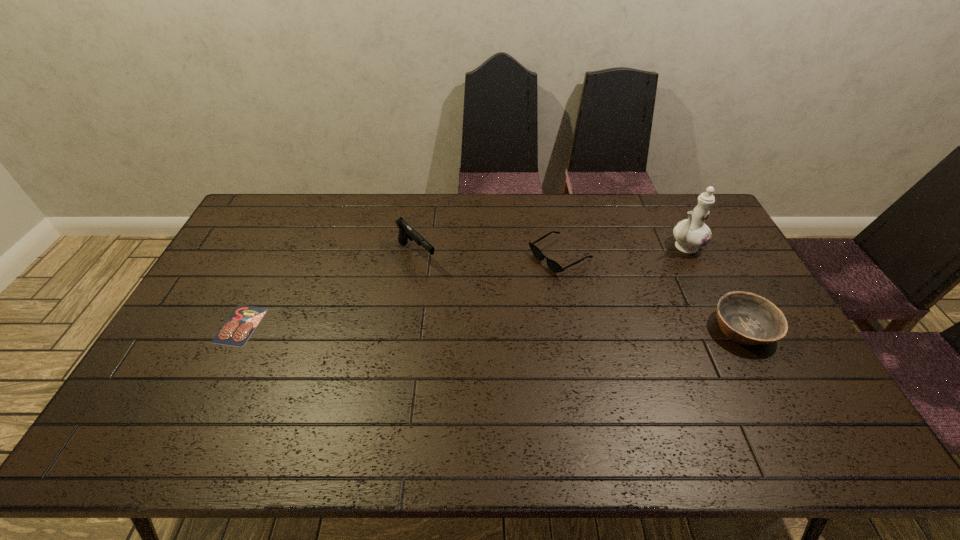
I want to click on vacant space that satisfies the following two spatial constraints: 1. on the front side of the third tallest object; 2. on the left side of the chinaware, so click(x=726, y=328).

Locate an element on the screen. vacant area in the image that satisfies the following two spatial constraints: 1. on the front side of the third tallest object; 2. on the left side of the shortest object is located at coordinates (239, 328).

This screenshot has height=540, width=960. What are the coordinates of `free location that satisfies the following two spatial constraints: 1. on the back side of the second tallest object; 2. on the left side of the shortest object` in the screenshot? It's located at (275, 256).

Locate an element on the screen. This screenshot has height=540, width=960. blank area in the image that satisfies the following two spatial constraints: 1. on the front side of the bowl; 2. on the left side of the sunglasses is located at coordinates (573, 328).

Where is `free space that satisfies the following two spatial constraints: 1. on the front side of the leftmost object; 2. on the left side of the third tallest object`? free space that satisfies the following two spatial constraints: 1. on the front side of the leftmost object; 2. on the left side of the third tallest object is located at coordinates (239, 328).